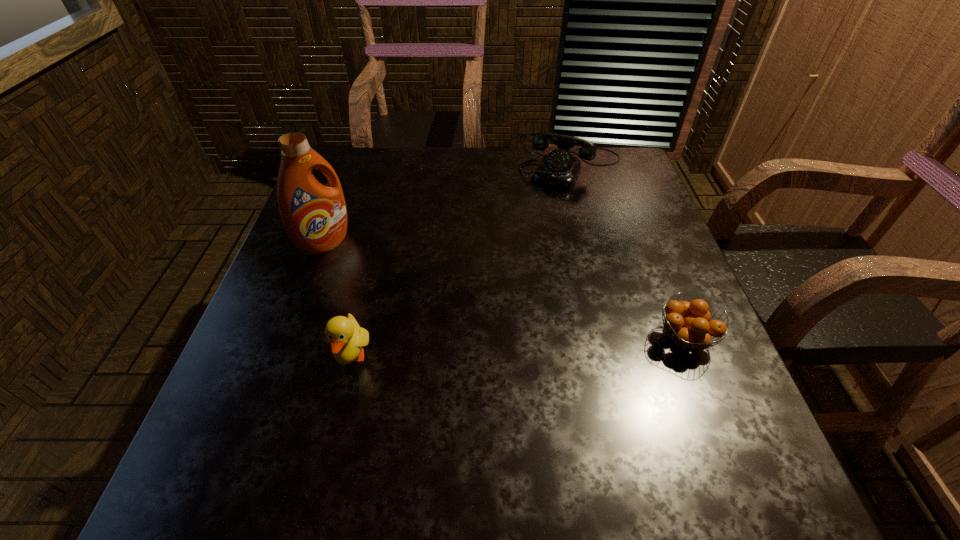
Locate an element on the screen. This screenshot has height=540, width=960. vacant space on the desktop that is between the duckling and the shortest object and is positioned on the front-facing side of the second farthest object is located at coordinates (491, 349).

Image resolution: width=960 pixels, height=540 pixels. Identify the location of free space on the desktop that is between the second object from left to right and the shortest object and is positioned on the front-facing side of the telephone. (482, 350).